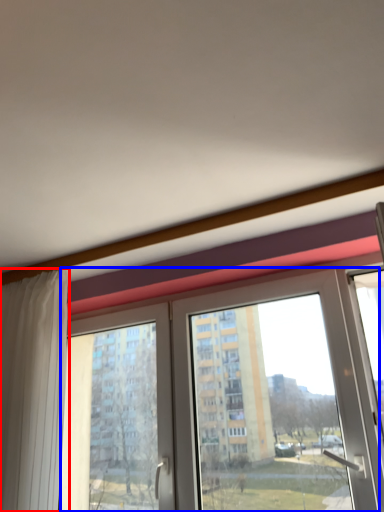
Question: Which object is closer to the camera taking this photo, curtain (highlighted by a red box) or window (highlighted by a blue box)?

Choices:
 (A) curtain
 (B) window

Answer: (B)